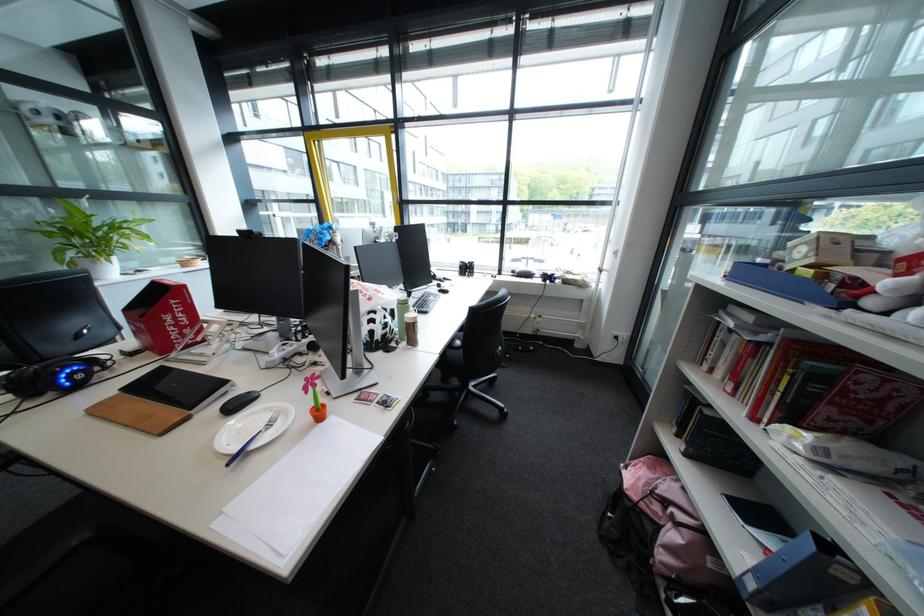
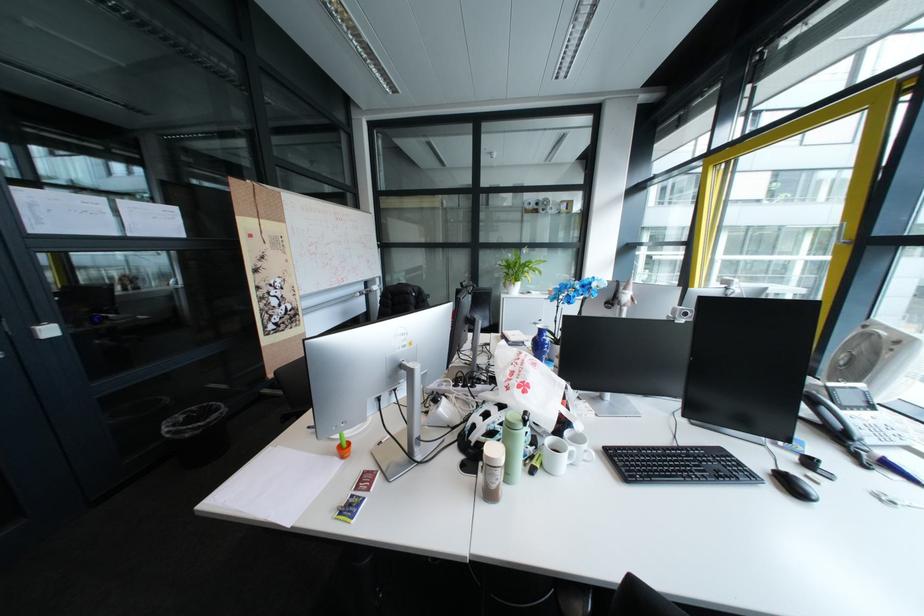
Question: I am providing you with two images of the same scene from different viewpoints. Which of the following objects are not visible in image2?

Choices:
 (A) blue and white vase
 (B) green water bottle
 (C) black keyboard
 (D) none of these

Answer: (D)